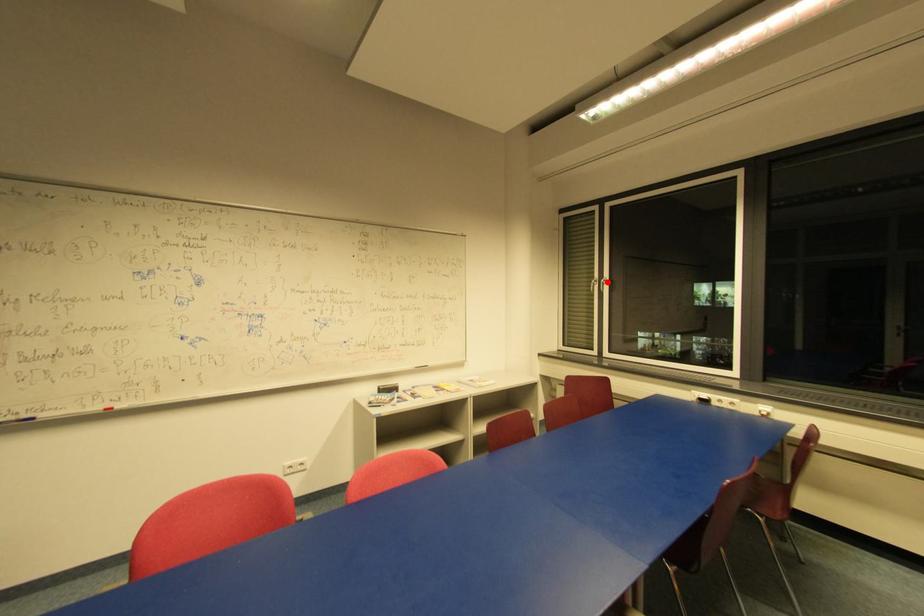
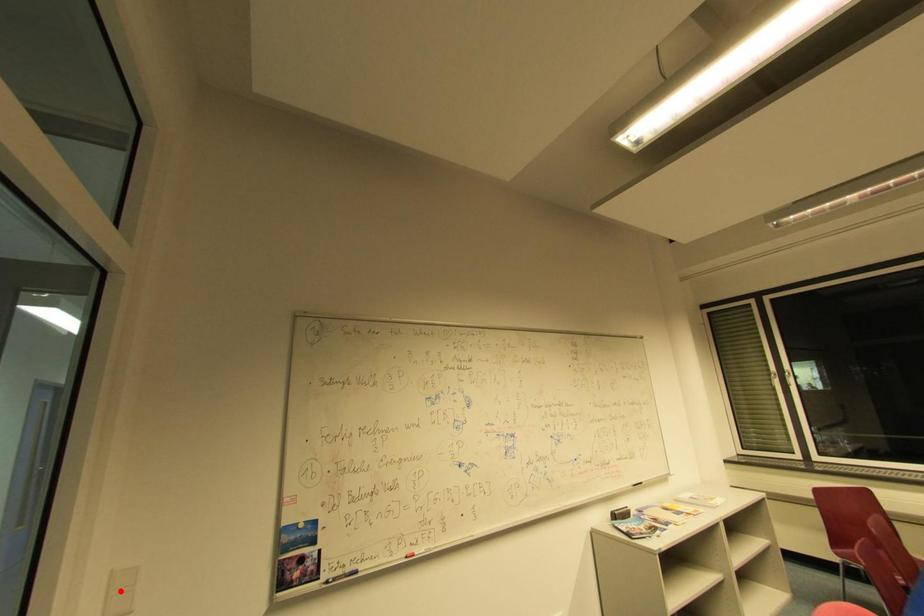
I am providing you with two images of the same scene from different viewpoints. A red point is marked on the first image and another point is marked on the second image. Is the marked point in image1 the same physical position as the marked point in image2?

No